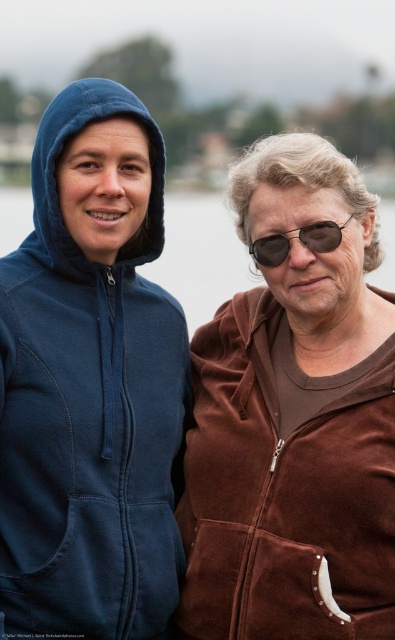
You are a photographer trying to capture a closeup of the matte blue hoodie at left. The camera you are using has a focal length of 50mm. Based on the coordinates provided, can you determine if the point marked at (90, 384) is within the frame of the camera?

The point marked at (90, 384) corresponds to the matte blue hoodie at left, so yes, the point is within the frame of the camera since it is the subject being photographed.

You are a photographer setting up a shot of the two people in the scene. You need to ensure that the brown suede jacket at right and the sunglasses at right are both visible in the frame. Given their relative sizes, which object should you focus on to make sure both are in focus?

The brown suede jacket at right has a greater height compared to sunglasses at right, so focusing on the brown suede jacket at right will ensure both objects are in focus since it is larger and likely closer to the camera.

You are a photographer trying to capture a clear shot of both the matte blue hoodie at left and the brown suede jacket at right. Based on their positions, which one is closer to the camera?

The matte blue hoodie at left is positioned over the brown suede jacket at right, meaning it is closer to the camera.